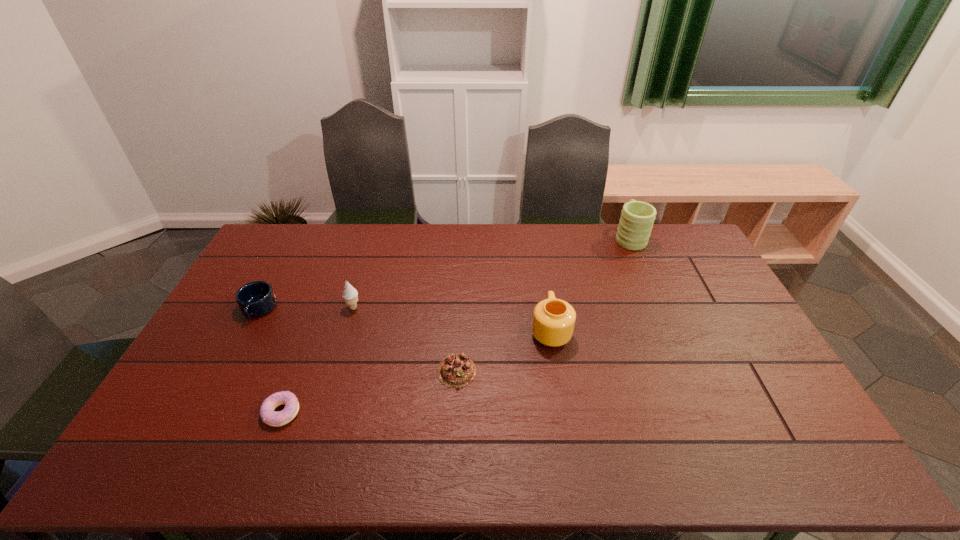
Locate an element on the screen. free location that satisfies the following two spatial constraints: 1. with the handle on the side of the leftmost object; 2. on the right side of the fifth tallest object is located at coordinates (226, 371).